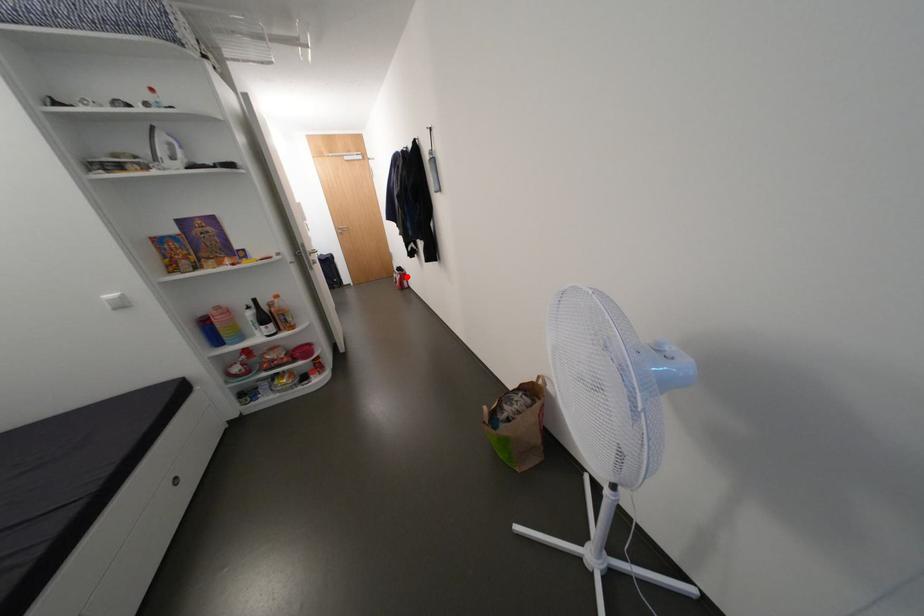
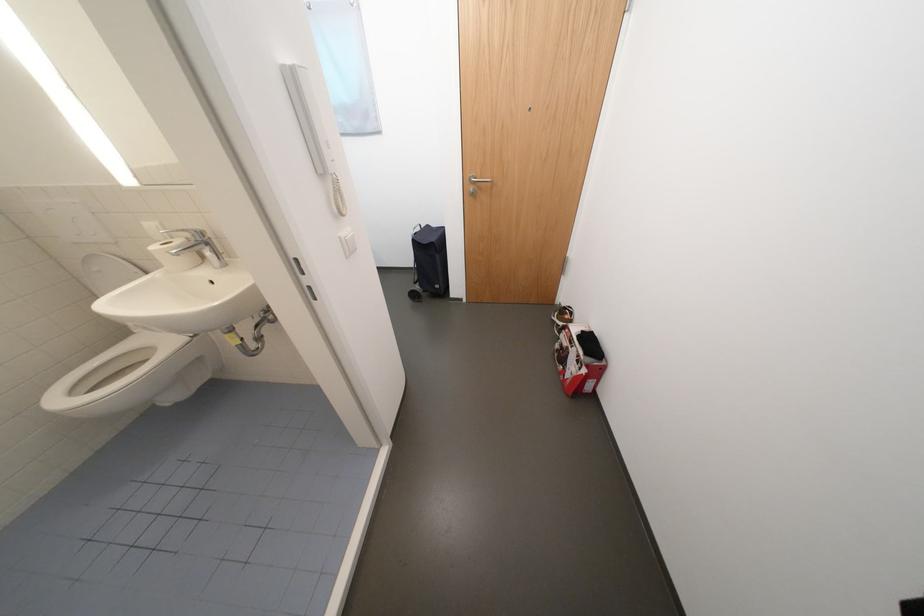
Where in the second image is the point corresponding to the highlighted location from the first image?

(592, 371)